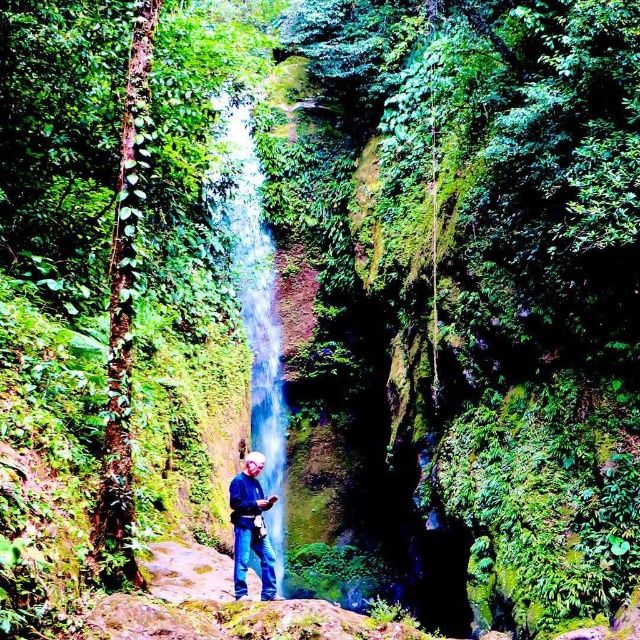
From the picture: You are standing at the base of the waterfall and see the translucent glass waterfall at center and the blue jeans at lower center. Which object is positioned to the left when facing the waterfall?

The translucent glass waterfall at center is positioned to the left of the blue jeans at lower center when facing the waterfall.

You are standing at the base of the waterfall and want to place your blue jeans at lower center on the ground. Can you fit them horizontally without overlapping the translucent glass waterfall at center?

The translucent glass waterfall at center is taller than blue jeans at lower center, so placing the blue jeans horizontally at lower center would not overlap vertically. However, since the waterfall is centrally positioned and the jeans are at lower center, their horizontal placement might still be obstructed by the waterfall base or surrounding rocks. Check the ground space carefully before placing them.

You are standing at the edge of the cliff looking at the scene. If you want to take a photo of the blue jeans at lower center without the translucent glass waterfall at center blocking the view, where should you move to?

You should move to a position in front of the translucent glass waterfall at center so that the blue jeans at lower center is no longer blocked by it.